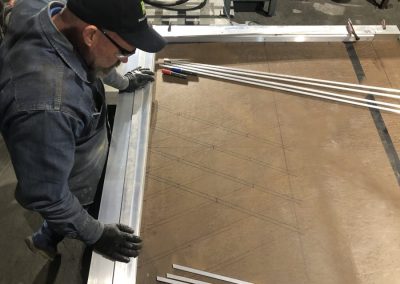
The height and width of the screenshot is (284, 400). What are the coordinates of `floor` in the screenshot? It's located at (292, 9), (362, 14), (4, 211), (21, 258).